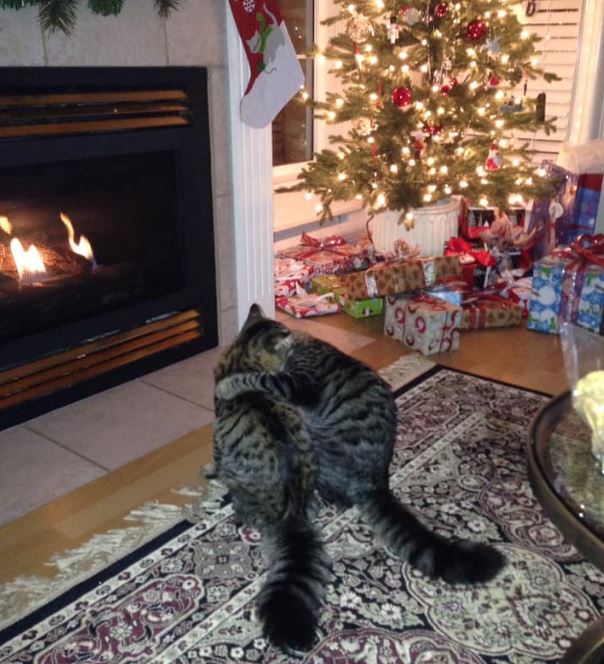
Where is `hardwood floor`? hardwood floor is located at coordinates (138, 479), (513, 363).